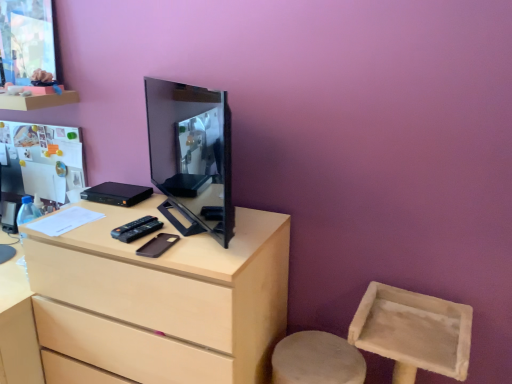
Question: From the image's perspective, would you say black glossy monitor at center is shown under light wood chest of drawers at center?

Choices:
 (A) no
 (B) yes

Answer: (A)

Question: Can you confirm if black glossy monitor at center is shorter than light wood chest of drawers at center?

Choices:
 (A) yes
 (B) no

Answer: (A)

Question: Is black glossy monitor at center thinner than light wood chest of drawers at center?

Choices:
 (A) no
 (B) yes

Answer: (B)

Question: Is black glossy monitor at center aimed at light wood chest of drawers at center?

Choices:
 (A) no
 (B) yes

Answer: (A)

Question: Is black glossy monitor at center closer to camera compared to light wood chest of drawers at center?

Choices:
 (A) no
 (B) yes

Answer: (B)

Question: In the image, is matte wood shelf at upper left positioned in front of or behind black glossy monitor at center?

Choices:
 (A) behind
 (B) front

Answer: (A)

Question: From the image's perspective, is matte wood shelf at upper left above or below black glossy monitor at center?

Choices:
 (A) above
 (B) below

Answer: (A)

Question: Considering the positions of matte wood shelf at upper left and black glossy monitor at center in the image, is matte wood shelf at upper left taller or shorter than black glossy monitor at center?

Choices:
 (A) short
 (B) tall

Answer: (A)

Question: Is matte wood shelf at upper left situated inside black glossy monitor at center or outside?

Choices:
 (A) inside
 (B) outside

Answer: (B)

Question: Which is correct: black glossy monitor at center is inside light wood chest of drawers at center, or outside of it?

Choices:
 (A) inside
 (B) outside

Answer: (B)

Question: In terms of size, does black glossy monitor at center appear bigger or smaller than light wood chest of drawers at center?

Choices:
 (A) big
 (B) small

Answer: (B)

Question: Is black glossy monitor at center in front of or behind light wood chest of drawers at center in the image?

Choices:
 (A) front
 (B) behind

Answer: (A)

Question: Considering the relative positions of black glossy monitor at center and light wood chest of drawers at center in the image provided, is black glossy monitor at center to the left or to the right of light wood chest of drawers at center?

Choices:
 (A) left
 (B) right

Answer: (B)

Question: Considering the relative positions of light wood chest of drawers at center and matte wood shelf at upper left in the image provided, is light wood chest of drawers at center to the left or to the right of matte wood shelf at upper left?

Choices:
 (A) left
 (B) right

Answer: (B)

Question: Based on their sizes in the image, would you say light wood chest of drawers at center is bigger or smaller than matte wood shelf at upper left?

Choices:
 (A) big
 (B) small

Answer: (A)